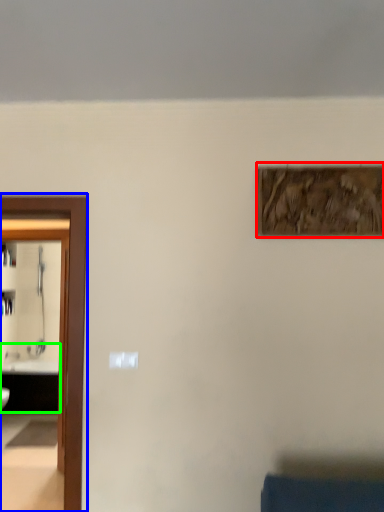
Question: Which object is positioned farthest from picture frame (highlighted by a red box)? Select from elevator (highlighted by a blue box) and sink (highlighted by a green box).

Choices:
 (A) elevator
 (B) sink

Answer: (B)